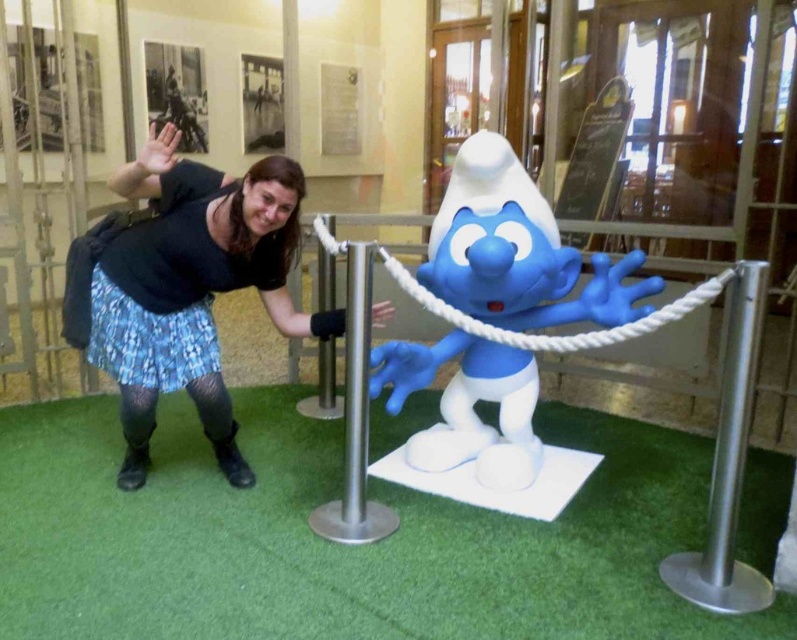
You are a museum visitor who wants to take a photo of the blue plastic smurf at center and the silver metallic pole at center. Which object should you focus on first if you want to capture both in a single frame without moving your camera?

The blue plastic smurf at center is taller than the silver metallic pole at center, so you should focus on the blue plastic smurf at center first to ensure it fits within the frame.

You are a photographer trying to capture a photo of the silver metallic pole at center without including the black fabric skirt at center in the frame. Given their sizes, is this possible?

The black fabric skirt at center has a larger size compared to silver metallic pole at center, so it is possible to capture the silver metallic pole at center without the black fabric skirt at center by adjusting the camera angle to focus on the smaller pole while excluding the larger skirt.

You are a security guard in the museum and need to ensure that the black fabric skirt at center and the blue plastic smurf at center are both visible to visitors. Since the blue plastic smurf is taller, which object should you place closer to the front of the display to ensure both are visible?

The black fabric skirt at center is smaller than the blue plastic smurf at center, so to ensure both are visible, the smaller black fabric skirt at center should be placed closer to the front of the display.